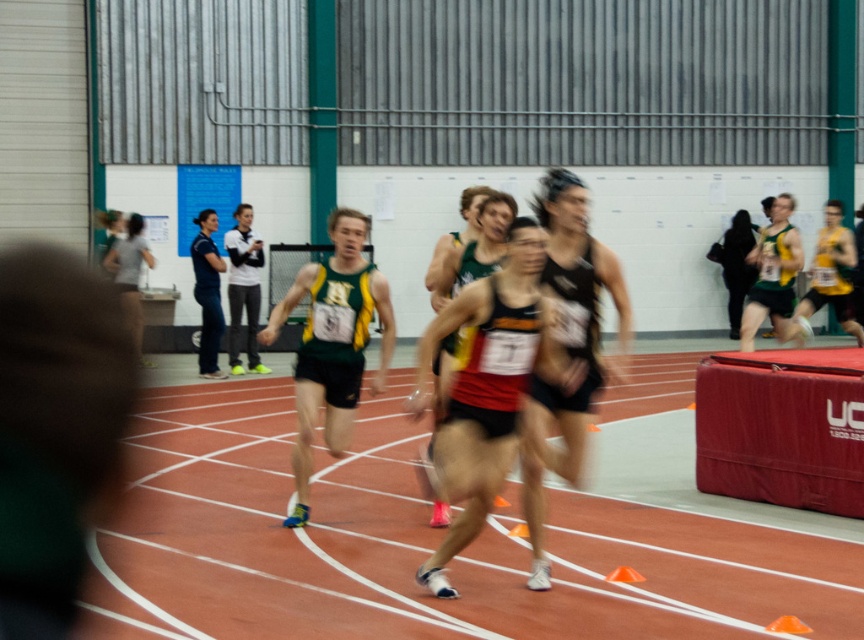
Question: Is white jersey at center above matte gray shirt at left?

Choices:
 (A) no
 (B) yes

Answer: (B)

Question: Which object appears farthest from the camera in this image?

Choices:
 (A) white jersey at center
 (B) green/yellow athletic uniform at center
 (C) dark blue jersey at center
 (D) reddish-brown athletic uniform at center

Answer: (A)

Question: Can you confirm if black mesh running shoe at center is positioned below white jersey at center?

Choices:
 (A) no
 (B) yes

Answer: (B)

Question: Estimate the real-world distances between objects in this image. Which object is farther from the black mesh running shoe at center?

Choices:
 (A) green jersey at right
 (B) green/yellow athletic uniform at center
 (C) matte black tank top at right
 (D) matte gray shirt at left

Answer: (C)

Question: Does green jersey at right have a smaller size compared to white jersey at center?

Choices:
 (A) no
 (B) yes

Answer: (B)

Question: Based on their relative distances, which object is nearer to the white jersey at center?

Choices:
 (A) matte gray shirt at left
 (B) matte black tank top at right

Answer: (A)